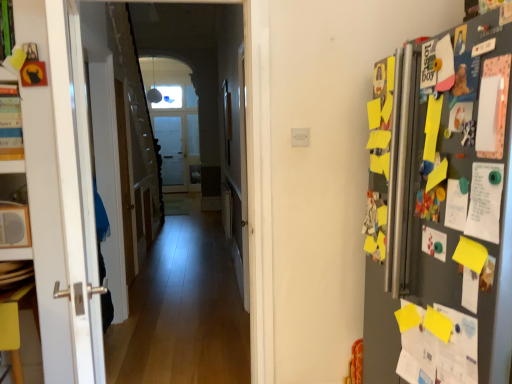
Question: Does yellow paper at lower right have a greater height compared to white matte speaker at left?

Choices:
 (A) yes
 (B) no

Answer: (A)

Question: Is yellow paper at lower right behind white matte speaker at left?

Choices:
 (A) yes
 (B) no

Answer: (B)

Question: Considering the relative sizes of yellow paper at lower right and white matte speaker at left in the image provided, is yellow paper at lower right shorter than white matte speaker at left?

Choices:
 (A) no
 (B) yes

Answer: (A)

Question: Is yellow paper at lower right far away from white matte speaker at left?

Choices:
 (A) yes
 (B) no

Answer: (A)

Question: From the image's perspective, would you say yellow paper at lower right is shown under white matte speaker at left?

Choices:
 (A) yes
 (B) no

Answer: (A)

Question: Considering the positions of point (125, 132) and point (157, 97), is point (125, 132) closer or farther from the camera than point (157, 97)?

Choices:
 (A) closer
 (B) farther

Answer: (A)

Question: In terms of size, does wooden door at center, the second door in the front-to-back sequence, appear bigger or smaller than matte white lampshade at upper center?

Choices:
 (A) big
 (B) small

Answer: (A)

Question: From a real-world perspective, is wooden door at center, acting as the 1th door starting from the left, above or below matte white lampshade at upper center?

Choices:
 (A) above
 (B) below

Answer: (B)

Question: Looking at their shapes, would you say wooden door at center, the first door when ordered from back to front, is wider or thinner than matte white lampshade at upper center?

Choices:
 (A) wide
 (B) thin

Answer: (B)

Question: Based on their positions, is wooden floor at center located to the left or right of yellow matte table at lower left?

Choices:
 (A) right
 (B) left

Answer: (A)

Question: From the image's perspective, is wooden floor at center positioned above or below yellow matte table at lower left?

Choices:
 (A) above
 (B) below

Answer: (A)

Question: Considering their positions, is wooden floor at center located in front of or behind yellow matte table at lower left?

Choices:
 (A) behind
 (B) front

Answer: (B)

Question: Considering the positions of point (104, 9) and point (10, 334), is point (104, 9) closer or farther from the camera than point (10, 334)?

Choices:
 (A) farther
 (B) closer

Answer: (A)

Question: Is yellow paper at lower right wider or thinner than wooden door at center, arranged as the 1th door when viewed from the front?

Choices:
 (A) wide
 (B) thin

Answer: (A)

Question: From a real-world perspective, relative to wooden door at center, the 1th door in the right-to-left sequence, is yellow paper at lower right vertically above or below?

Choices:
 (A) below
 (B) above

Answer: (A)